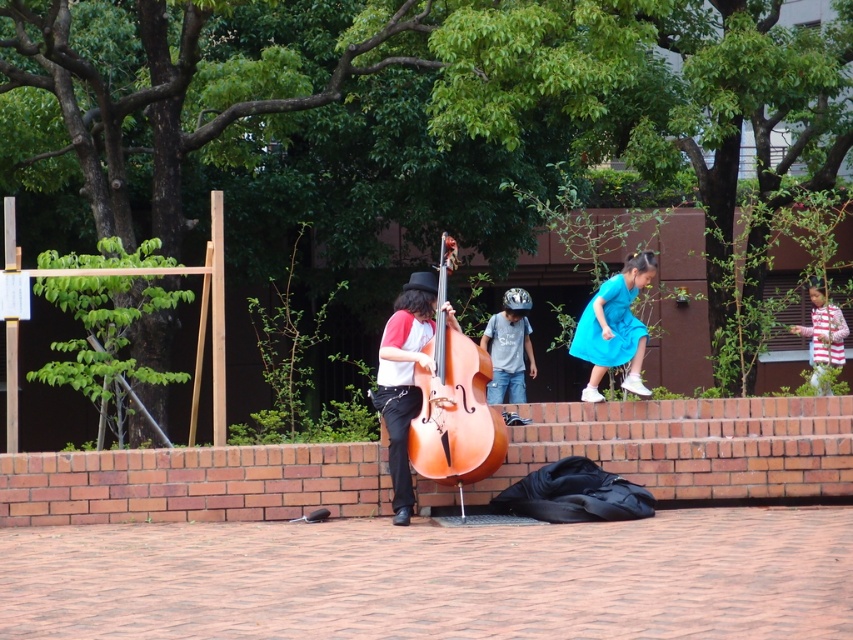
Can you confirm if matte brown cello at center is smaller than striped cotton shirt at right?

Correct, matte brown cello at center occupies less space than striped cotton shirt at right.

Between matte brown cello at center and striped cotton shirt at right, which one has more height?

With more height is matte brown cello at center.

At what (x,y) coordinates should I click in order to perform the action: click on matte brown cello at center. Please return your answer as a coordinate pair (x, y). The height and width of the screenshot is (640, 853). Looking at the image, I should click on (403, 380).

Between point (486, 362) and point (418, 273), which one is positioned in front?

Point (486, 362)

Which is behind, point (479, 480) or point (434, 289)?

Point (434, 289)

The image size is (853, 640). What are the coordinates of `wooden polished cello at center` in the screenshot? It's located at (454, 401).

Is point (595, 333) positioned behind point (532, 369)?

That is False.

Can you confirm if matte blue dress at upper right is bigger than blue denim jeans at center?

No, matte blue dress at upper right is not bigger than blue denim jeans at center.

Which is in front, point (599, 292) or point (505, 296)?

Point (599, 292) is in front.

In order to click on matte blue dress at upper right in this screenshot , I will do `click(614, 326)`.